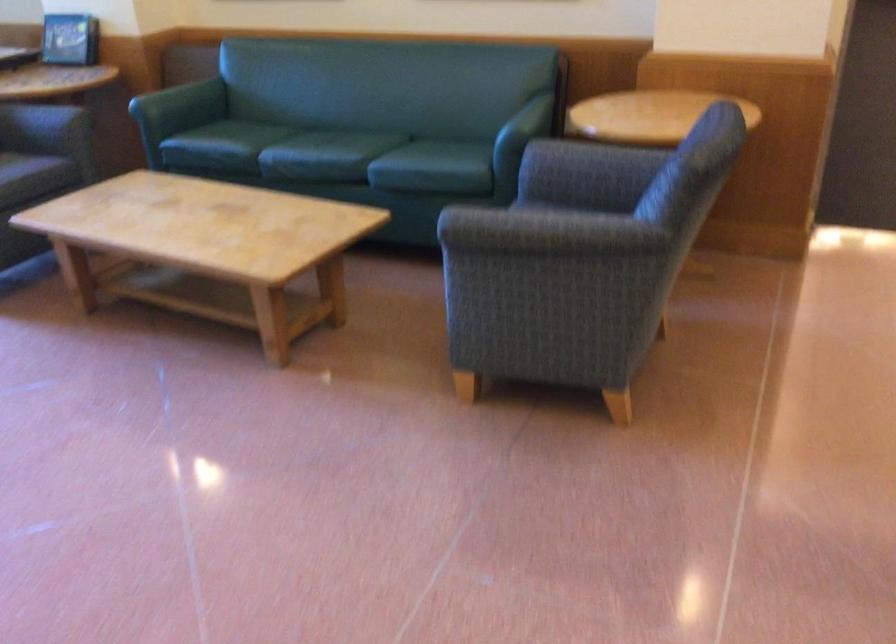
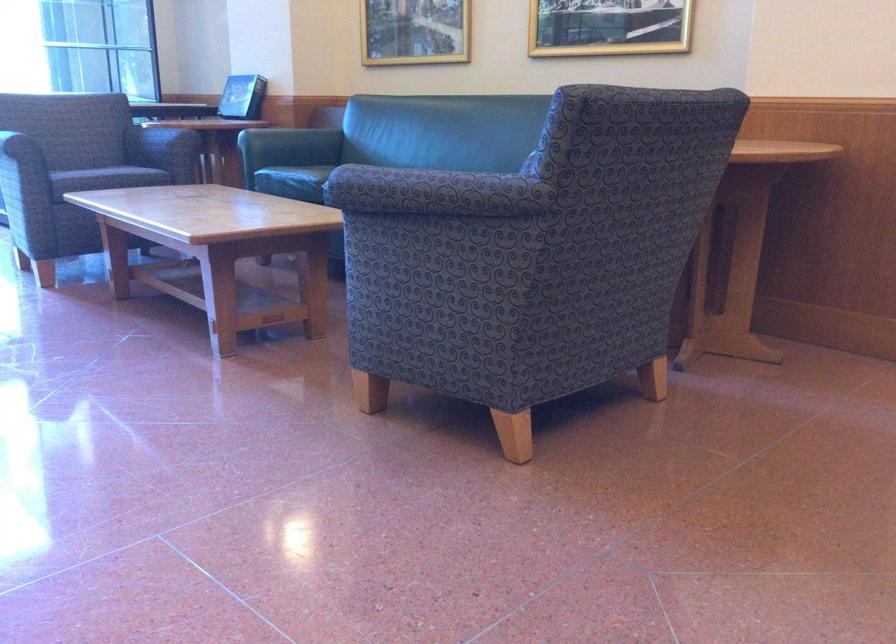
Where in the second image is the point corresponding to pixel 188 106 from the first image?

(290, 145)